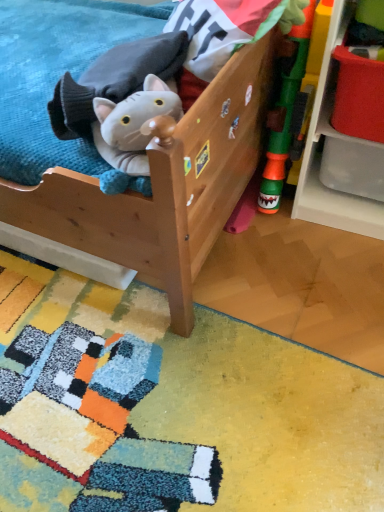
Question: Can white plastic shelf at right be found inside fluffy gray plush cat at upper left, the second toy when ordered from right to left?

Choices:
 (A) no
 (B) yes

Answer: (A)

Question: Is fluffy gray plush cat at upper left, which is the first toy from left to right, positioned far away from white plastic shelf at right?

Choices:
 (A) no
 (B) yes

Answer: (A)

Question: Can you confirm if fluffy gray plush cat at upper left, which is the first toy from left to right, is positioned to the right of white plastic shelf at right?

Choices:
 (A) no
 (B) yes

Answer: (A)

Question: From a real-world perspective, is fluffy gray plush cat at upper left, the second toy when ordered from right to left, positioned over white plastic shelf at right based on gravity?

Choices:
 (A) no
 (B) yes

Answer: (B)

Question: Is fluffy gray plush cat at upper left, which is the first toy from left to right, bigger than white plastic shelf at right?

Choices:
 (A) yes
 (B) no

Answer: (B)

Question: Is rubberized green toy at right, the first toy in the right-to-left sequence, situated inside white plastic shelf at right or outside?

Choices:
 (A) inside
 (B) outside

Answer: (B)

Question: Based on their positions, is rubberized green toy at right, which is the second toy in left-to-right order, located to the left or right of white plastic shelf at right?

Choices:
 (A) left
 (B) right

Answer: (A)

Question: Is rubberized green toy at right, which is the second toy in left-to-right order, bigger or smaller than white plastic shelf at right?

Choices:
 (A) big
 (B) small

Answer: (B)

Question: Is rubberized green toy at right, which is the second toy in left-to-right order, in front of or behind white plastic shelf at right in the image?

Choices:
 (A) front
 (B) behind

Answer: (B)

Question: Visually, is fluffy gray plush cat at upper left, the second toy when ordered from right to left, positioned to the left or to the right of rubberized green toy at right, which is the second toy in left-to-right order?

Choices:
 (A) right
 (B) left

Answer: (B)

Question: From the image's perspective, is fluffy gray plush cat at upper left, the second toy when ordered from right to left, located above or below rubberized green toy at right, which is the second toy in left-to-right order?

Choices:
 (A) above
 (B) below

Answer: (B)

Question: Based on their sizes in the image, would you say fluffy gray plush cat at upper left, which is the first toy from left to right, is bigger or smaller than rubberized green toy at right, the first toy in the right-to-left sequence?

Choices:
 (A) small
 (B) big

Answer: (B)

Question: Does point (162, 66) appear closer or farther from the camera than point (281, 86)?

Choices:
 (A) closer
 (B) farther

Answer: (A)

Question: In the image, is fluffy gray plush cat at upper left, the second toy when ordered from right to left, on the left side or the right side of white plastic shelf at right?

Choices:
 (A) left
 (B) right

Answer: (A)

Question: Choose the correct answer: Is fluffy gray plush cat at upper left, which is the first toy from left to right, inside white plastic shelf at right or outside it?

Choices:
 (A) inside
 (B) outside

Answer: (B)